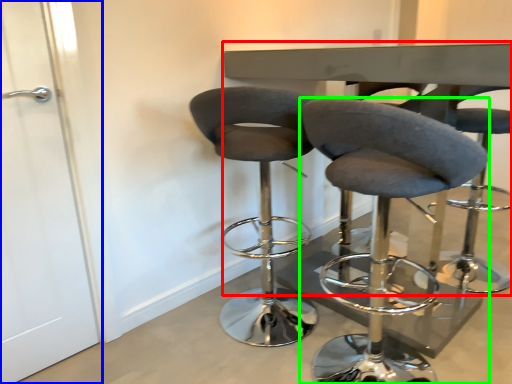
Question: Which object is the farthest from round table (highlighted by a red box)? Choose among these: screen door (highlighted by a blue box) or chair (highlighted by a green box).

Choices:
 (A) screen door
 (B) chair

Answer: (A)